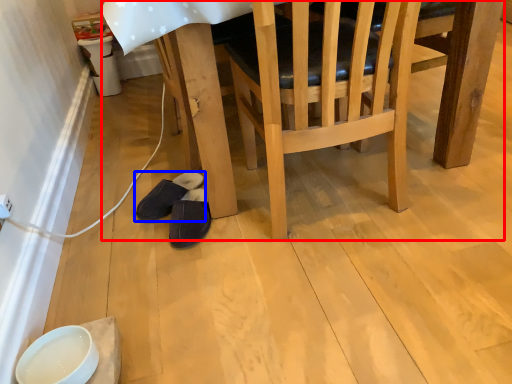
Question: Which object appears farthest to the camera in this image, table (highlighted by a red box) or footwear (highlighted by a blue box)?

Choices:
 (A) table
 (B) footwear

Answer: (B)